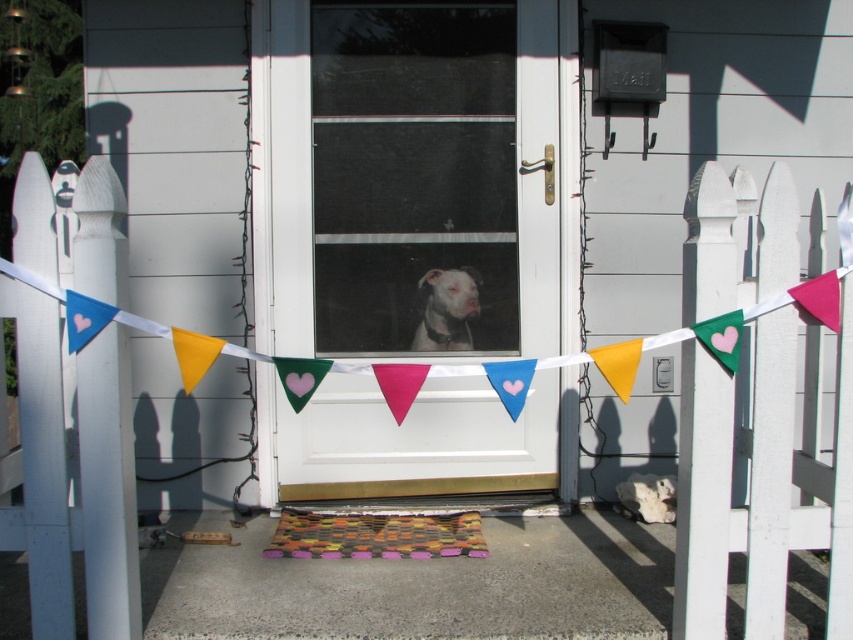
Who is higher up, multicolored woven mat at center or white matte dog at center?

Positioned higher is white matte dog at center.

Is multicolored woven mat at center taller than white matte dog at center?

In fact, multicolored woven mat at center may be shorter than white matte dog at center.

Which is in front, point (450, 522) or point (437, 301)?

Point (450, 522) is in front.

Image resolution: width=853 pixels, height=640 pixels. Find the location of `multicolored woven mat at center`. multicolored woven mat at center is located at coordinates (376, 536).

Which is in front, point (438, 3) or point (415, 541)?

Point (415, 541)

Is point (515, 154) less distant than point (320, 554)?

No, (515, 154) is further to viewer.

You are a GUI agent. You are given a task and a screenshot of the screen. Output one action in this format:
    pyautogui.click(x=<x>, y=<y>)
    Task: Click on the white glossy screen door at center
    Image resolution: width=853 pixels, height=640 pixels.
    Given the screenshot: What is the action you would take?
    pyautogui.click(x=413, y=173)

Can you confirm if white glossy screen door at center is taller than white matte dog at center?

Yes.

Is white glossy screen door at center smaller than white matte dog at center?

Actually, white glossy screen door at center might be larger than white matte dog at center.

Where is `white glossy screen door at center`? white glossy screen door at center is located at coordinates (413, 173).